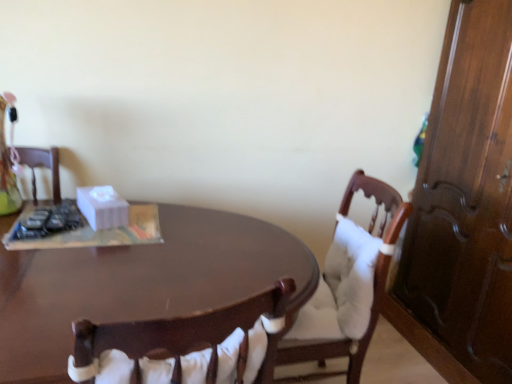
Identify the location of vacant space to the right of white matte tissue box at center. The image size is (512, 384). (174, 223).